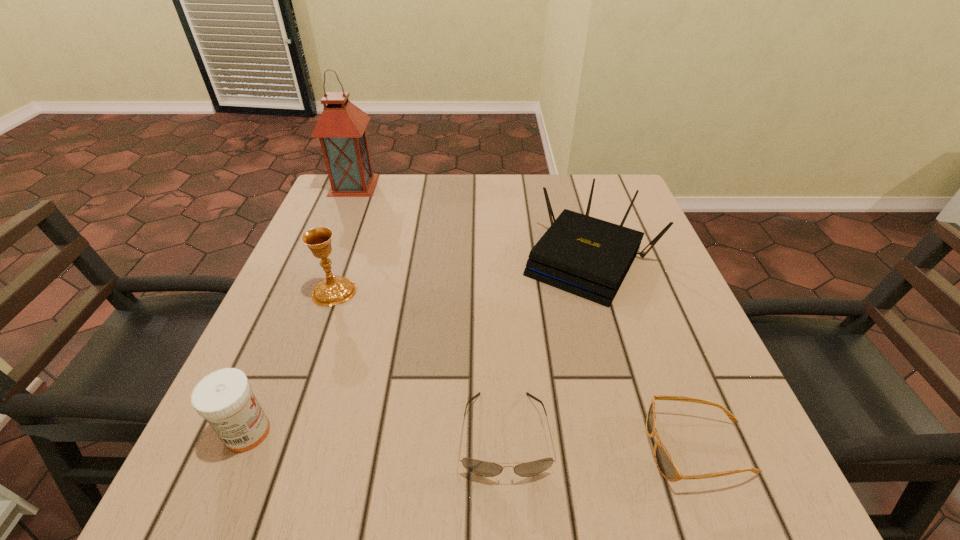
At what (x,y) coordinates should I click in order to perform the action: click on the tallest object. Please return your answer as a coordinate pair (x, y). Looking at the image, I should click on (341, 127).

You are a GUI agent. You are given a task and a screenshot of the screen. Output one action in this format:
    pyautogui.click(x=<x>, y=<y>)
    Task: Click on the lantern
    
    Given the screenshot: What is the action you would take?
    pyautogui.click(x=341, y=127)

Find the location of a particular element. This screenshot has height=540, width=960. chalice is located at coordinates (333, 290).

Locate an element on the screen. The height and width of the screenshot is (540, 960). router is located at coordinates (585, 256).

Locate an element on the screen. The height and width of the screenshot is (540, 960). medicine is located at coordinates (224, 398).

Find the location of a particular element. the left sunglasses is located at coordinates (482, 468).

Where is `the right sunglasses`? The height and width of the screenshot is (540, 960). the right sunglasses is located at coordinates (664, 462).

This screenshot has height=540, width=960. Find the location of `vacant region located on the right of the tallest object`. vacant region located on the right of the tallest object is located at coordinates (401, 185).

Where is `free space located on the right of the chalice`? The image size is (960, 540). free space located on the right of the chalice is located at coordinates (437, 292).

Where is `blank space located 0.070m on the front of the router`? This screenshot has width=960, height=540. blank space located 0.070m on the front of the router is located at coordinates (611, 334).